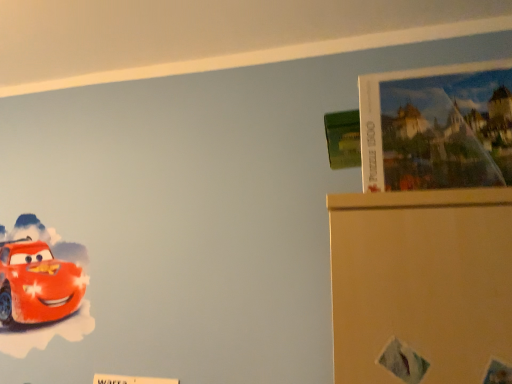
Find the location of a particular element. The height and width of the screenshot is (384, 512). matte plastic puzzle box at upper right is located at coordinates (437, 127).

This screenshot has width=512, height=384. Describe the element at coordinates (437, 127) in the screenshot. I see `matte plastic puzzle box at upper right` at that location.

Find the location of a particular element. The image size is (512, 384). matte plastic puzzle box at upper right is located at coordinates coord(437,127).